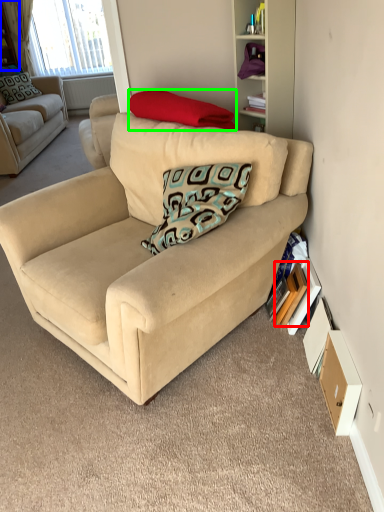
Question: Which object is positioned closest to paperback book (highlighted by a red box)? Select from shelf (highlighted by a blue box) and pillow (highlighted by a green box).

Choices:
 (A) shelf
 (B) pillow

Answer: (B)